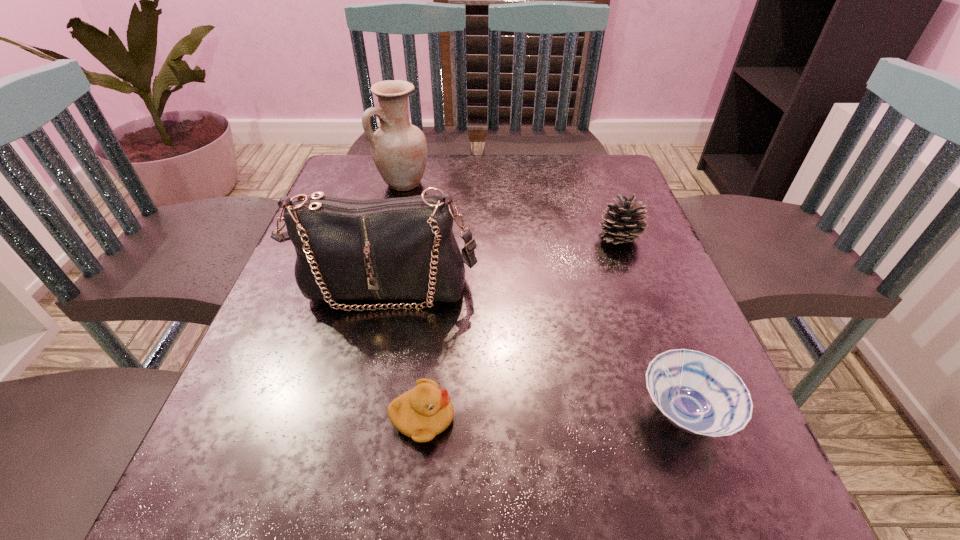
This screenshot has height=540, width=960. Identify the location of pottery. (399, 149).

Where is `the third nearest object`? The height and width of the screenshot is (540, 960). the third nearest object is located at coordinates (404, 248).

Find the location of a particular element. This screenshot has height=540, width=960. the third shortest object is located at coordinates (623, 221).

At what (x,y) coordinates should I click in order to perform the action: click on pinecone. Please return your answer as a coordinate pair (x, y). Looking at the image, I should click on (623, 221).

Locate an element on the screen. The height and width of the screenshot is (540, 960). duckling is located at coordinates (425, 411).

Identify the location of the shortest object. (697, 393).

Find the location of a particular element. This screenshot has width=960, height=540. free location located on the back of the pottery is located at coordinates [409, 158].

Where is `vacant space positioned at the front of the handbag with chain and zipper`? This screenshot has width=960, height=540. vacant space positioned at the front of the handbag with chain and zipper is located at coordinates (362, 394).

Identify the location of free space located on the front of the third tallest object. pos(679,396).

The width and height of the screenshot is (960, 540). I want to click on free spot located 0.120m at the beak of the fourth tallest object, so click(x=535, y=418).